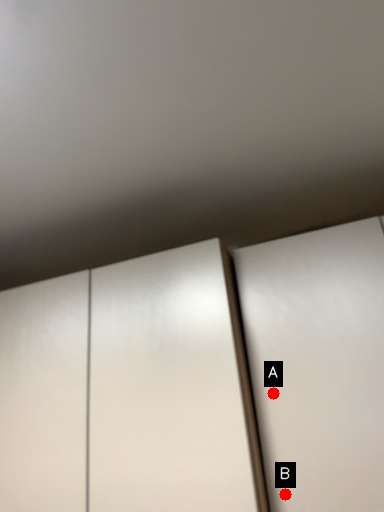
Question: Two points are circled on the image, labeled by A and B beside each circle. Which of the following is the closest to the observer?

Choices:
 (A) A is closer
 (B) B is closer

Answer: (B)